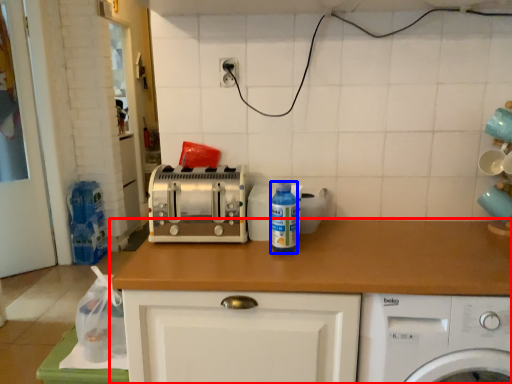
Question: Which object is closer to the camera taking this photo, countertop (highlighted by a red box) or bottle (highlighted by a blue box)?

Choices:
 (A) countertop
 (B) bottle

Answer: (A)